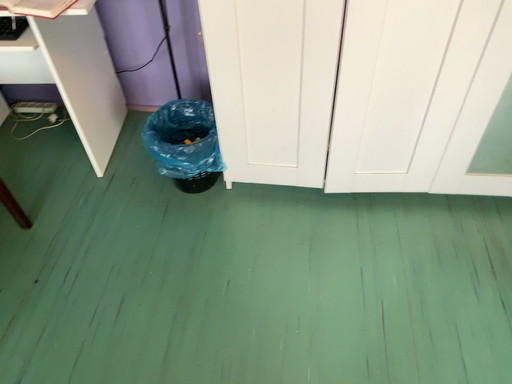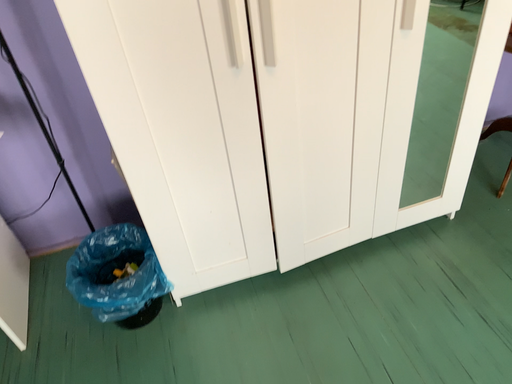
Question: How did the camera likely rotate when shooting the video?

Choices:
 (A) rotated downward
 (B) rotated upward

Answer: (B)